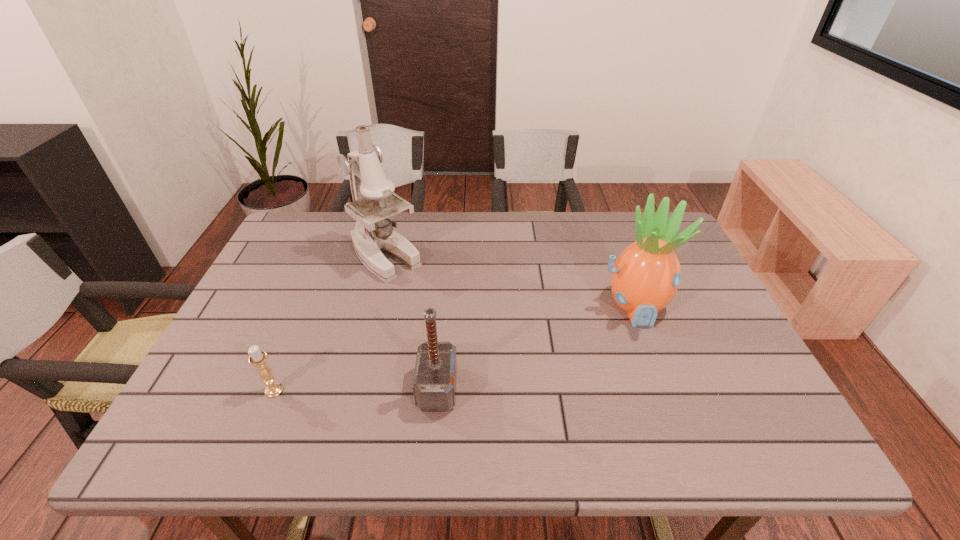
Where is `free space located 0.380m on the left of the hammer`? free space located 0.380m on the left of the hammer is located at coordinates (246, 389).

The height and width of the screenshot is (540, 960). What are the coordinates of `free space located on the right of the shortest object` in the screenshot? It's located at (315, 390).

At what (x,y) coordinates should I click in order to perform the action: click on object positioned at the far edge. Please return your answer as a coordinate pair (x, y). Image resolution: width=960 pixels, height=540 pixels. Looking at the image, I should click on click(373, 233).

Where is `object that is positioned at the near edge`? Image resolution: width=960 pixels, height=540 pixels. object that is positioned at the near edge is located at coordinates (434, 384).

What are the coordinates of `object that is at the left edge` in the screenshot? It's located at (258, 358).

In order to click on object located at the right edge in this screenshot , I will do `click(645, 277)`.

In the image, there is a desktop. Where is `vacant region at the far edge`? The image size is (960, 540). vacant region at the far edge is located at coordinates (611, 242).

Find the location of a particular element. The width and height of the screenshot is (960, 540). free location at the left edge is located at coordinates (292, 277).

What are the coordinates of `free spot at the right edge of the desktop` in the screenshot? It's located at (688, 276).

The height and width of the screenshot is (540, 960). I want to click on free point at the far right corner, so click(x=627, y=234).